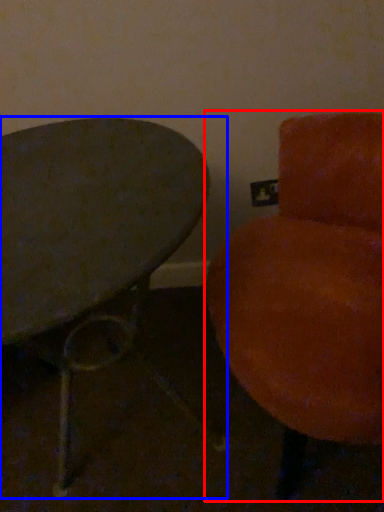
Question: Which object is further to the camera taking this photo, chair (highlighted by a red box) or table (highlighted by a blue box)?

Choices:
 (A) chair
 (B) table

Answer: (B)